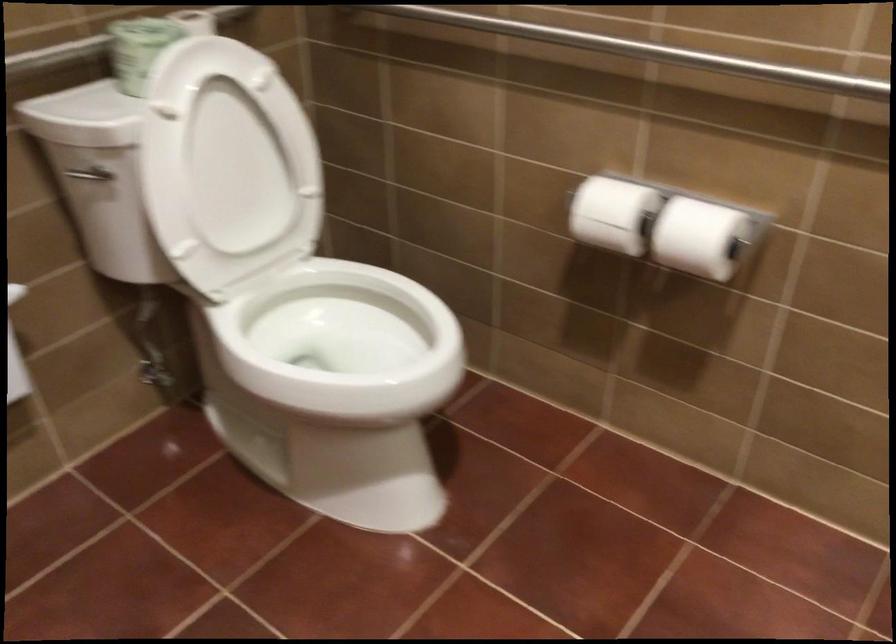
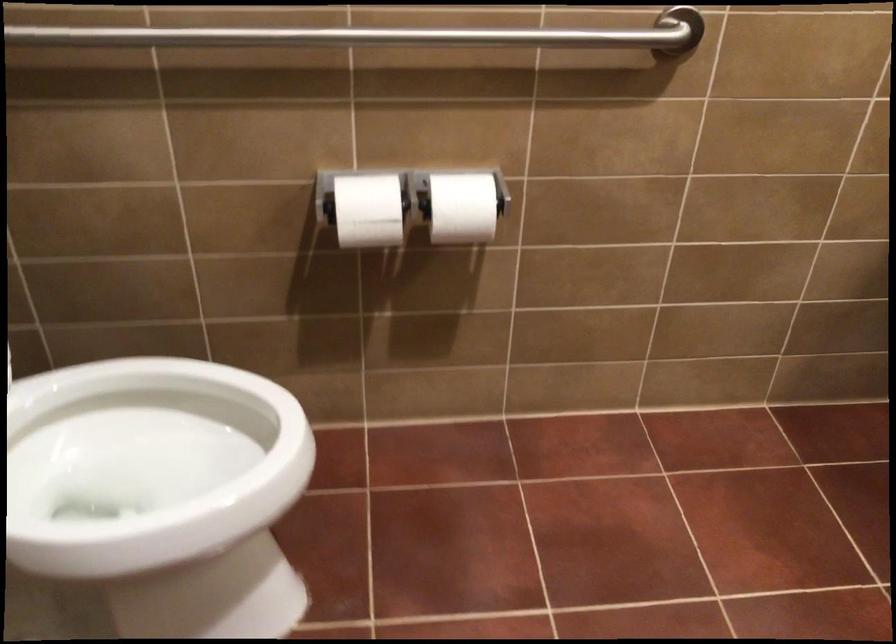
Locate, in the second image, the point that corresponds to (364,348) in the first image.

(147, 464)